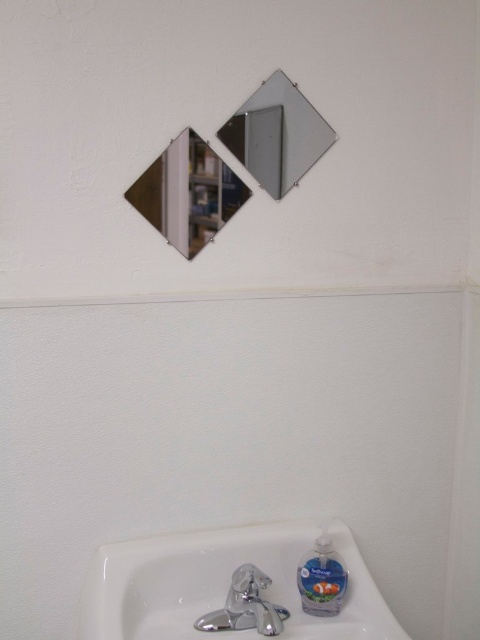
You are standing in the bathroom looking at the wall with the mirrors and sink area. There are two points marked on the wall, one at point coordinates point (120, 592) and the other at point coordinates point (284, 131). Which point appears closer to you?

Point (120, 592) is closer to the camera than point (284, 131), so the point at coordinates point (120, 592) appears closer to you.

You are a plumber trying to install a new faucet. You have the chrome metallic faucet at lower center and need to ensure it fits the white glossy sink at lower center. Based on their sizes, will the faucet fit properly?

The white glossy sink at lower center is wider than the chrome metallic faucet at lower center. Since the sink is larger in width, the faucet should fit properly as it will have enough space to be mounted on the sink.